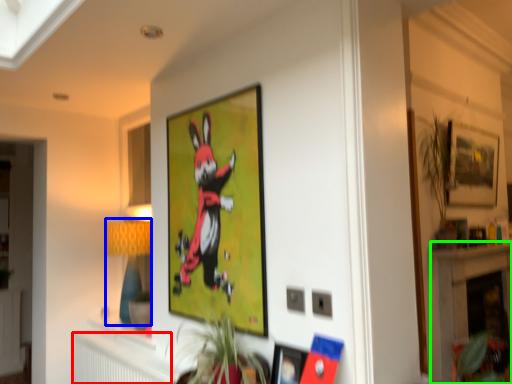
Question: Which object is the closest to the radiator (highlighted by a red box)? Choose among these: lamp (highlighted by a blue box) or fireplace (highlighted by a green box).

Choices:
 (A) lamp
 (B) fireplace

Answer: (A)